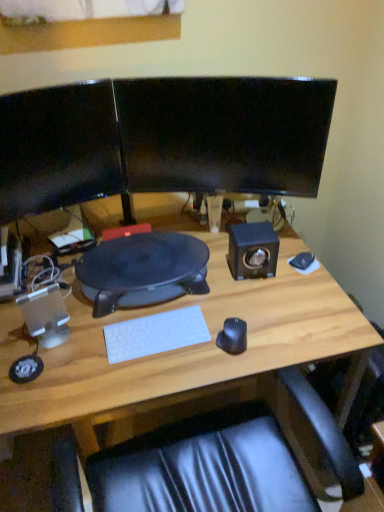
Find the location of a particular element. Image resolution: width=384 pixels, height=512 pixels. empty space that is ontop of white matte keyboard at center (from a real-world perspective) is located at coordinates [153, 330].